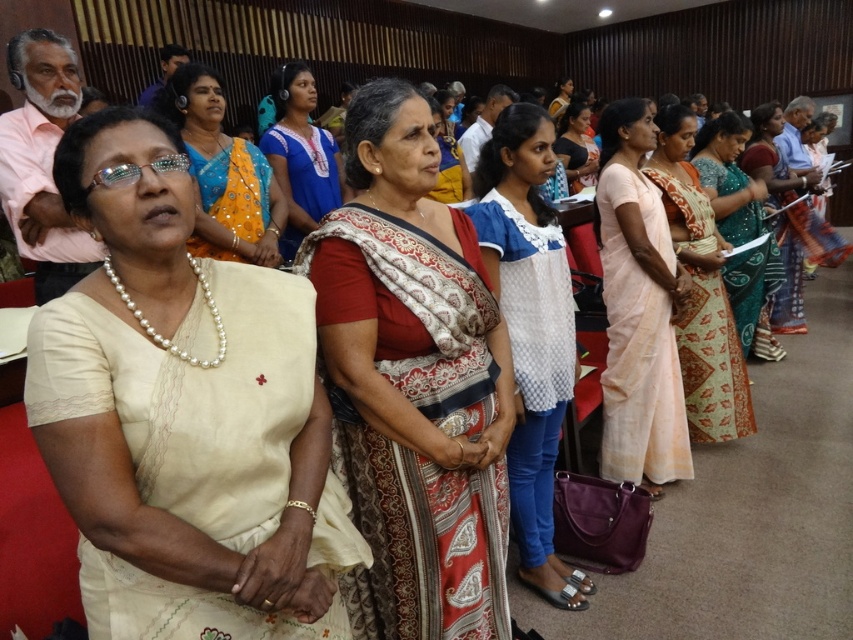
Does blue cotton blouse at center come behind green silk saree at right?

No.

Is blue cotton blouse at center thinner than green silk saree at right?

Yes.

Identify the location of blue cotton blouse at center. The width and height of the screenshot is (853, 640). (300, 156).

The height and width of the screenshot is (640, 853). I want to click on blue cotton blouse at center, so click(x=300, y=156).

Is matte cream blouse at center positioned in front of pale pink silk saree at center?

Yes, it is.

Does point (264, 348) lie in front of point (636, 314)?

Yes.

The image size is (853, 640). Find the location of `matte cream blouse at center`. matte cream blouse at center is located at coordinates (183, 413).

Is matte cream blouse at center further to the viewer compared to red and white patterned saree at center?

No.

Who is more forward, (96, 180) or (373, 84)?

Positioned in front is point (96, 180).

The height and width of the screenshot is (640, 853). In order to click on matte cream blouse at center in this screenshot , I will do `click(183, 413)`.